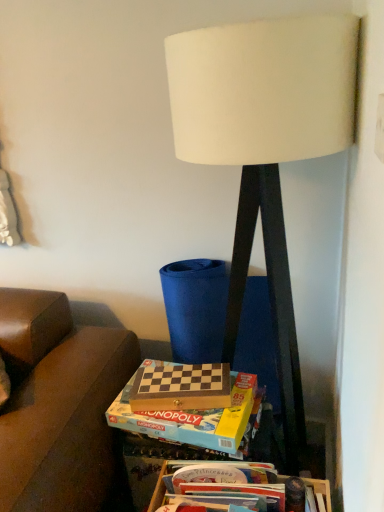
Question: Does wooden board game at center appear on the left side of wooden board game at lower center, which appears as the second box when viewed from the top?

Choices:
 (A) yes
 (B) no

Answer: (A)

Question: From a real-world perspective, is wooden board game at center over wooden board game at lower center, which appears as the second box when viewed from the top?

Choices:
 (A) yes
 (B) no

Answer: (A)

Question: Is wooden board game at center in front of wooden board game at lower center, which appears as the second box when viewed from the top?

Choices:
 (A) no
 (B) yes

Answer: (A)

Question: Is wooden board game at center shorter than wooden board game at lower center, which appears as the second box when viewed from the top?

Choices:
 (A) no
 (B) yes

Answer: (A)

Question: Is wooden board game at center far away from wooden board game at lower center, which appears as the second box when viewed from the top?

Choices:
 (A) yes
 (B) no

Answer: (B)

Question: Considering the positions of wooden chess set at center, acting as the first box starting from the top, and wooden board game at lower center, which is the first box in bottom-to-top order, in the image, is wooden chess set at center, acting as the first box starting from the top, taller or shorter than wooden board game at lower center, which is the first box in bottom-to-top order,?

Choices:
 (A) short
 (B) tall

Answer: (A)

Question: Is wooden chess set at center, positioned as the 2th box in bottom-to-top order, bigger or smaller than wooden board game at lower center, which appears as the second box when viewed from the top?

Choices:
 (A) small
 (B) big

Answer: (A)

Question: Is wooden chess set at center, positioned as the 2th box in bottom-to-top order, inside or outside of wooden board game at lower center, which appears as the second box when viewed from the top?

Choices:
 (A) inside
 (B) outside

Answer: (B)

Question: From a real-world perspective, is wooden chess set at center, positioned as the 2th box in bottom-to-top order, positioned above or below wooden board game at lower center, which is the first box in bottom-to-top order?

Choices:
 (A) above
 (B) below

Answer: (A)

Question: Considering the positions of wooden chessboard at center and white fabric lampshade at center in the image, is wooden chessboard at center bigger or smaller than white fabric lampshade at center?

Choices:
 (A) big
 (B) small

Answer: (B)

Question: Is wooden chessboard at center wider or thinner than white fabric lampshade at center?

Choices:
 (A) wide
 (B) thin

Answer: (B)

Question: In the image, is wooden chessboard at center positioned in front of or behind white fabric lampshade at center?

Choices:
 (A) front
 (B) behind

Answer: (B)

Question: Is wooden chessboard at center spatially inside white fabric lampshade at center, or outside of it?

Choices:
 (A) outside
 (B) inside

Answer: (B)

Question: In terms of width, does wooden board game at center look wider or thinner when compared to white fabric lampshade at center?

Choices:
 (A) thin
 (B) wide

Answer: (A)

Question: From the image's perspective, is wooden board game at center located above or below white fabric lampshade at center?

Choices:
 (A) above
 (B) below

Answer: (B)